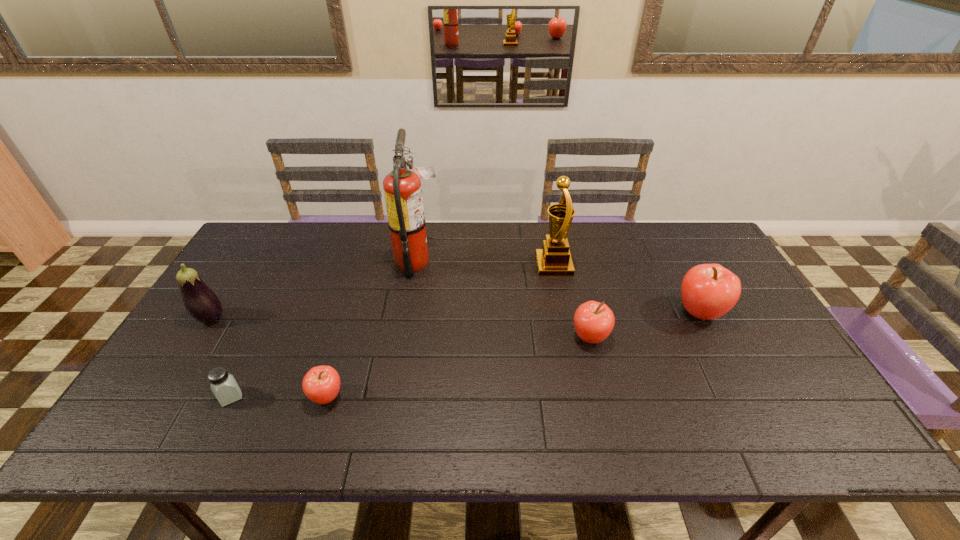
What are the coordinates of `vacant space at the far left corner` in the screenshot? It's located at (260, 237).

In the image, there is a desktop. In order to click on vacant space at the far right corner in this screenshot , I will do `click(667, 243)`.

You are a GUI agent. You are given a task and a screenshot of the screen. Output one action in this format:
    pyautogui.click(x=<x>, y=<y>)
    Task: Click on the unoccupied position between the leftmost apple and the leftmost object
    The height and width of the screenshot is (540, 960).
    Given the screenshot: What is the action you would take?
    269,357

Locate an element on the screen. The height and width of the screenshot is (540, 960). unoccupied area between the sixth object from right to left and the rightmost object is located at coordinates (466, 355).

In order to click on free space between the fourth object from left to right and the saltshaker in this screenshot , I will do `click(324, 329)`.

Find the location of a particular element. empty space that is in between the fourth object from right to left and the leftmost object is located at coordinates (314, 290).

Image resolution: width=960 pixels, height=540 pixels. I want to click on empty space between the second apple from right to left and the fire extinguisher, so click(504, 300).

At what (x,y) coordinates should I click in order to perform the action: click on vacant region between the tallest apple and the eggplant. Please return your answer as a coordinate pair (x, y). This screenshot has height=540, width=960. Looking at the image, I should click on (455, 315).

Find the location of `unoccupied area between the shortest apple and the second apple from left to right`. unoccupied area between the shortest apple and the second apple from left to right is located at coordinates (458, 367).

Identify the location of empty location between the sixth shortest object and the leftmost object. (382, 292).